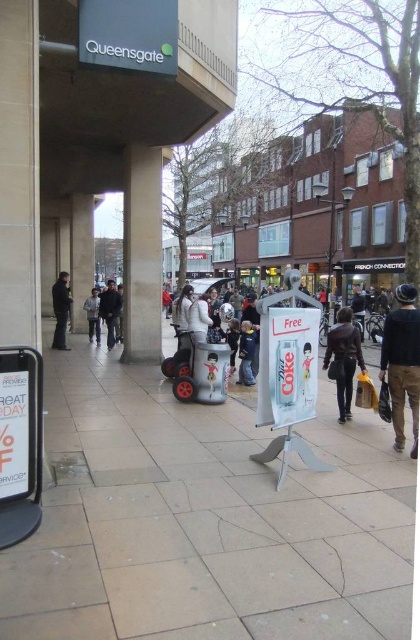
Can you confirm if smooth concrete pavement at center is smaller than matte white scooter at center?

Yes, smooth concrete pavement at center is smaller than matte white scooter at center.

Consider the image. Does smooth concrete pavement at center appear on the left side of matte white scooter at center?

No, smooth concrete pavement at center is not to the left of matte white scooter at center.

Between point (183, 586) and point (178, 364), which one is positioned behind?

The point (178, 364) is behind.

Identify the location of smooth concrete pavement at center. (205, 518).

Measure the distance between point (204, 372) and camera.

Point (204, 372) and camera are 8.11 meters apart from each other.

Is matte white scooter at center positioned at the back of leather jacket at center?

Yes.

You are a GUI agent. You are given a task and a screenshot of the screen. Output one action in this format:
    pyautogui.click(x=<x>, y=<y>)
    Task: Click on the matte white scooter at center
    Image resolution: width=420 pixels, height=640 pixels.
    Given the screenshot: What is the action you would take?
    pyautogui.click(x=199, y=369)

Find the location of `matte white scooter at center`. matte white scooter at center is located at coordinates (199, 369).

Locate an element on the screen. This screenshot has height=640, width=420. dark brown leather jacket at lower right is located at coordinates (403, 362).

Is dark brown leather jacket at lower right shorter than matte white scooter at center?

Yes, dark brown leather jacket at lower right is shorter than matte white scooter at center.

Is point (391, 364) positioned after point (176, 353)?

No.

Find the location of a particular element. Image resolution: width=420 pixels, height=640 pixels. dark brown leather jacket at lower right is located at coordinates (403, 362).